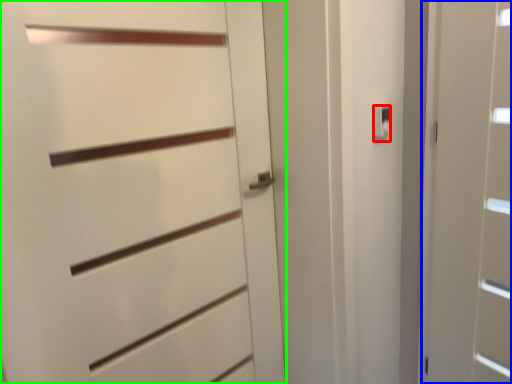
Question: Based on their relative distances, which object is farther from latch (highlighted by a red box)? Choose from door (highlighted by a blue box) and door (highlighted by a green box).

Choices:
 (A) door
 (B) door

Answer: (B)